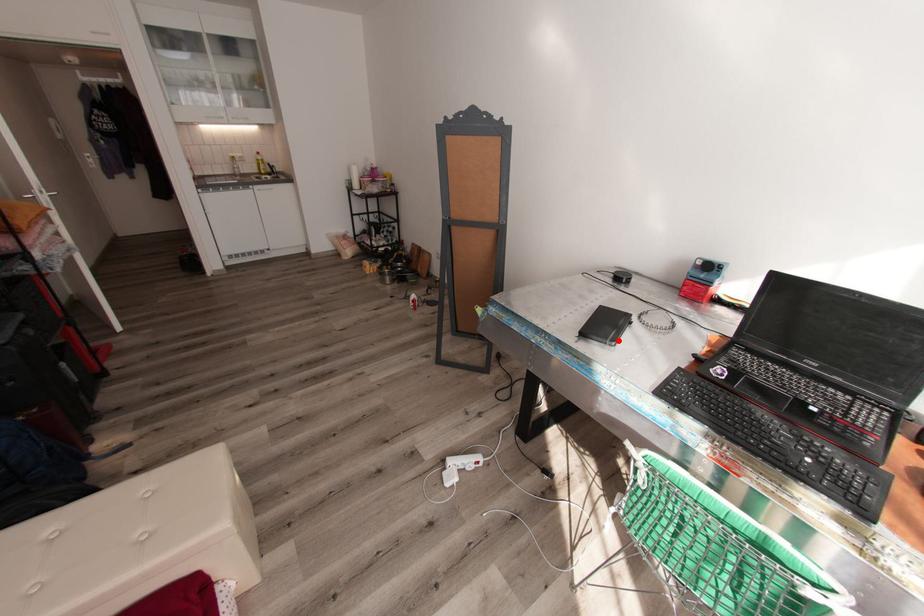
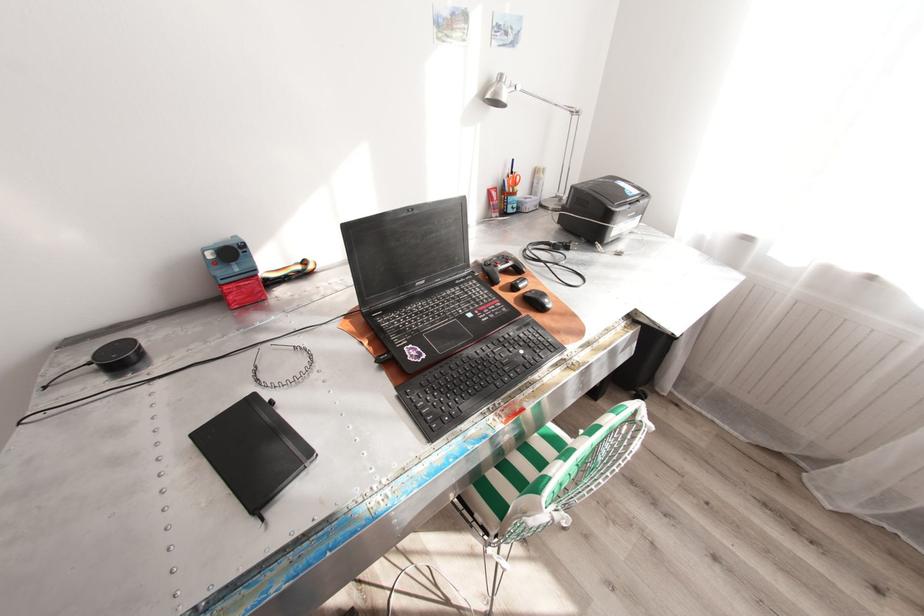
Find the pixel in the second image that matches the highlighted location in the first image.

(314, 452)